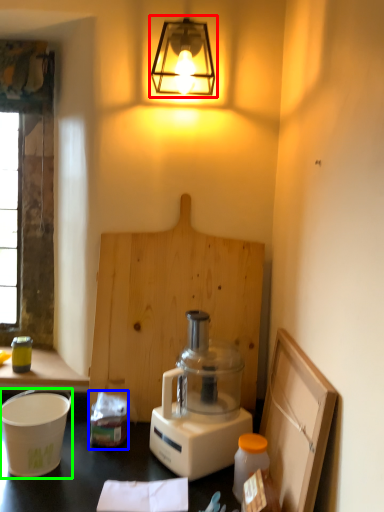
Question: Considering the real-world distances, which object is closest to lamp (highlighted by a red box)? waste (highlighted by a blue box) or appliance (highlighted by a green box).

Choices:
 (A) waste
 (B) appliance

Answer: (A)